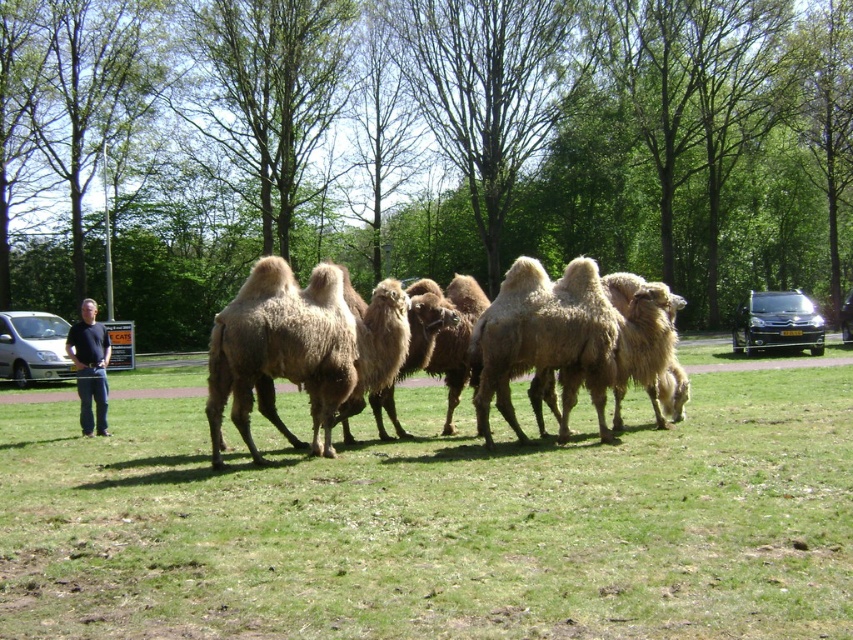
The height and width of the screenshot is (640, 853). Find the location of `black metallic car at right`. black metallic car at right is located at coordinates (776, 323).

Does black metallic car at right lie in front of black shirt at left?

No, it is behind black shirt at left.

Which is in front, point (796, 321) or point (103, 362)?

Point (103, 362)

What are the coordinates of `black metallic car at right` in the screenshot? It's located at (776, 323).

Is point (165, 557) in front of point (331, 333)?

That is True.

Does fuzzy beige camels at center appear over brown fuzzy camel at center?

No, fuzzy beige camels at center is not above brown fuzzy camel at center.

Is point (778, 593) more distant than point (364, 352)?

No.

At what (x,y) coordinates should I click in order to perform the action: click on fuzzy beige camels at center. Please return your answer as a coordinate pair (x, y). Image resolution: width=853 pixels, height=640 pixels. Looking at the image, I should click on (439, 524).

Who is positioned more to the left, fuzzy beige camels at center or silver metallic car at left?

From the viewer's perspective, silver metallic car at left appears more on the left side.

Between fuzzy beige camels at center and silver metallic car at left, which one is positioned higher?

silver metallic car at left is higher up.

Does point (407, 541) come farther from viewer compared to point (55, 371)?

No.

Locate an element on the screen. fuzzy beige camels at center is located at coordinates (439, 524).